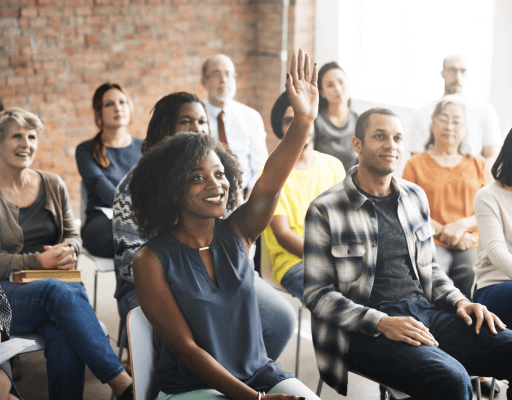
You are a GUI agent. You are given a task and a screenshot of the screen. Output one action in this format:
    pyautogui.click(x=<x>, y=<y>)
    Task: Click on the chairs
    The image size is (512, 400).
    Given the screenshot: What is the action you would take?
    pyautogui.click(x=32, y=344), pyautogui.click(x=99, y=260), pyautogui.click(x=142, y=330), pyautogui.click(x=317, y=386)